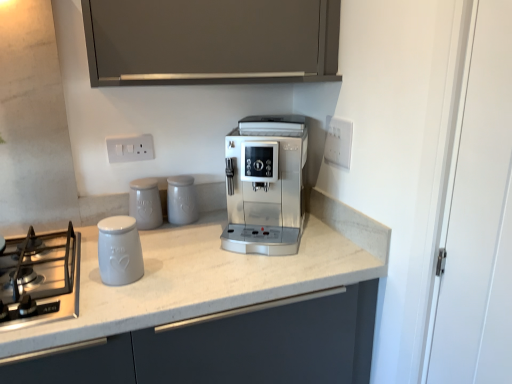
The width and height of the screenshot is (512, 384). Describe the element at coordinates (265, 185) in the screenshot. I see `satin silver coffee maker at center` at that location.

Locate an element on the screen. The height and width of the screenshot is (384, 512). satin silver coffee maker at center is located at coordinates (265, 185).

The height and width of the screenshot is (384, 512). Describe the element at coordinates (40, 279) in the screenshot. I see `stainless steel gas stove at lower left` at that location.

The width and height of the screenshot is (512, 384). Describe the element at coordinates (130, 148) in the screenshot. I see `white plastic electric outlet at upper center, which ranks as the 2th electric outlet in right-to-left order` at that location.

Describe the element at coordinates (338, 142) in the screenshot. This screenshot has width=512, height=384. I see `white plastic electrical outlet at upper right, the first electric outlet from the right` at that location.

How much space does matte ceramic canister at center, placed as the 1th kitchen appliance when sorted from back to front, occupy vertically?

It is 16.87 centimeters.

Locate an element on the screen. satin silver coffee maker at center is located at coordinates (265, 185).

Is satin silver coffee maker at center shorter than matte gray cabinet at upper center?

No, satin silver coffee maker at center is not shorter than matte gray cabinet at upper center.

Is point (249, 128) in front of point (177, 58)?

That is False.

Is satin silver coffee maker at center wider or thinner than matte gray cabinet at upper center?

satin silver coffee maker at center is wider than matte gray cabinet at upper center.

From the image's perspective, is satin silver coffee maker at center located above or below matte gray cabinet at upper center?

satin silver coffee maker at center is below matte gray cabinet at upper center.

Who is taller, matte gray cabinet at upper center or matte ceramic jar at center, the 2th kitchen appliance in the front-to-back sequence?

matte gray cabinet at upper center.

From a real-world perspective, is matte gray cabinet at upper center located higher than matte ceramic jar at center, which is the second kitchen appliance from back to front?

Yes, from a real-world perspective, matte gray cabinet at upper center is over matte ceramic jar at center, which is the second kitchen appliance from back to front

Does matte gray cabinet at upper center have a lesser width compared to matte ceramic jar at center, the 2th kitchen appliance in the front-to-back sequence?

Incorrect, the width of matte gray cabinet at upper center is not less than that of matte ceramic jar at center, the 2th kitchen appliance in the front-to-back sequence.

From the image's perspective, is matte ceramic jar at center, the 2th kitchen appliance in the front-to-back sequence, on white ceramic jar at center, the 1th kitchen appliance from the front?

Yes, from the image's perspective, matte ceramic jar at center, the 2th kitchen appliance in the front-to-back sequence, is on top of white ceramic jar at center, the 1th kitchen appliance from the front.

Can you confirm if matte ceramic jar at center, the 2th kitchen appliance in the front-to-back sequence, is smaller than white ceramic jar at center, the 1th kitchen appliance from the front?

Indeed, matte ceramic jar at center, the 2th kitchen appliance in the front-to-back sequence, has a smaller size compared to white ceramic jar at center, the 1th kitchen appliance from the front.

From a real-world perspective, which is physically above, matte ceramic jar at center, which is the second kitchen appliance from back to front, or white ceramic jar at center, the third kitchen appliance in the back-to-front sequence?

matte ceramic jar at center, which is the second kitchen appliance from back to front, from a real-world perspective.

Could white ceramic jar at center, the 1th kitchen appliance from the front, be considered to be inside matte ceramic jar at center, the 2th kitchen appliance in the front-to-back sequence?

No, white ceramic jar at center, the 1th kitchen appliance from the front, is not surrounded by matte ceramic jar at center, the 2th kitchen appliance in the front-to-back sequence.

Considering the points (329, 129) and (77, 298), which point is behind, point (329, 129) or point (77, 298)?

The point (329, 129) is behind.

Can you confirm if white plastic electrical outlet at upper right, the first electric outlet from the right, is positioned to the left of stainless steel gas stove at lower left?

No.

Does white plastic electrical outlet at upper right, the first electric outlet from the right, have a greater height compared to stainless steel gas stove at lower left?

Indeed, white plastic electrical outlet at upper right, the first electric outlet from the right, has a greater height compared to stainless steel gas stove at lower left.

From a real-world perspective, is white plastic electrical outlet at upper right, positioned as the second electric outlet in left-to-right order, physically located above or below stainless steel gas stove at lower left?

white plastic electrical outlet at upper right, positioned as the second electric outlet in left-to-right order, is situated higher than stainless steel gas stove at lower left in the real world.

From a real-world perspective, is white plastic electrical outlet at upper right, the first electric outlet from the right, physically located above or below white marble countertop at center?

From a real-world perspective, white plastic electrical outlet at upper right, the first electric outlet from the right, is physically above white marble countertop at center.

Could you tell me if white plastic electrical outlet at upper right, the first electric outlet from the right, is facing white marble countertop at center?

No.

Is white plastic electrical outlet at upper right, the first electric outlet from the right, closer to the viewer compared to white marble countertop at center?

No, it is not.

Considering the sizes of objects white plastic electrical outlet at upper right, the first electric outlet from the right, and white marble countertop at center in the image provided, who is shorter, white plastic electrical outlet at upper right, the first electric outlet from the right, or white marble countertop at center?

Standing shorter between the two is white plastic electrical outlet at upper right, the first electric outlet from the right.

Which object is more forward, white plastic electrical outlet at upper right, positioned as the second electric outlet in left-to-right order, or matte ceramic canister at center, placed as the 1th kitchen appliance when sorted from back to front?

white plastic electrical outlet at upper right, positioned as the second electric outlet in left-to-right order.

Which object is positioned more to the right, white plastic electrical outlet at upper right, positioned as the second electric outlet in left-to-right order, or matte ceramic canister at center, placed as the 1th kitchen appliance when sorted from back to front?

Positioned to the right is white plastic electrical outlet at upper right, positioned as the second electric outlet in left-to-right order.

Is white plastic electrical outlet at upper right, the first electric outlet from the right, in contact with matte ceramic canister at center, marked as the third kitchen appliance in a front-to-back arrangement?

No, white plastic electrical outlet at upper right, the first electric outlet from the right, is not touching matte ceramic canister at center, marked as the third kitchen appliance in a front-to-back arrangement.

In terms of width, does white plastic electrical outlet at upper right, positioned as the second electric outlet in left-to-right order, look wider or thinner when compared to matte ceramic canister at center, marked as the third kitchen appliance in a front-to-back arrangement?

Clearly, white plastic electrical outlet at upper right, positioned as the second electric outlet in left-to-right order, has less width compared to matte ceramic canister at center, marked as the third kitchen appliance in a front-to-back arrangement.

Is matte gray cabinet at upper center outside of white plastic electrical outlet at upper right, the first electric outlet from the right?

Yes, matte gray cabinet at upper center is not within white plastic electrical outlet at upper right, the first electric outlet from the right.

How many degrees apart are the facing directions of matte gray cabinet at upper center and white plastic electrical outlet at upper right, positioned as the second electric outlet in left-to-right order?

The facing directions of matte gray cabinet at upper center and white plastic electrical outlet at upper right, positioned as the second electric outlet in left-to-right order, are 90.8 degrees apart.

Is matte gray cabinet at upper center oriented towards white plastic electrical outlet at upper right, positioned as the second electric outlet in left-to-right order?

No, matte gray cabinet at upper center is not facing towards white plastic electrical outlet at upper right, positioned as the second electric outlet in left-to-right order.

This screenshot has height=384, width=512. Find the location of `coffee maker that appears below the matte gray cabinet at upper center (from the image's perspective)`. coffee maker that appears below the matte gray cabinet at upper center (from the image's perspective) is located at coordinates (265, 185).

This screenshot has width=512, height=384. I want to click on cabinetry above the matte ceramic jar at center, which is the second kitchen appliance from back to front (from the image's perspective), so click(x=211, y=41).

Looking at the image, which one is located further to white marble countertop at center, white ceramic jar at center, the third kitchen appliance in the back-to-front sequence, or white plastic electric outlet at upper center, which ranks as the 2th electric outlet in right-to-left order?

Based on the image, white plastic electric outlet at upper center, which ranks as the 2th electric outlet in right-to-left order, appears to be further to white marble countertop at center.

From the image, which object appears to be nearer to satin silver coffee maker at center, white plastic electric outlet at upper center, which ranks as the 2th electric outlet in right-to-left order, or matte gray cabinet at upper center?

Among the two, matte gray cabinet at upper center is located nearer to satin silver coffee maker at center.

Which object lies nearer to the anchor point stainless steel gas stove at lower left, matte gray cabinet at upper center or matte ceramic canister at center, placed as the 1th kitchen appliance when sorted from back to front?

Among the two, matte ceramic canister at center, placed as the 1th kitchen appliance when sorted from back to front, is located nearer to stainless steel gas stove at lower left.

From the image, which object appears to be nearer to matte ceramic jar at center, which is the second kitchen appliance from back to front, white plastic electrical outlet at upper right, the first electric outlet from the right, or stainless steel gas stove at lower left?

stainless steel gas stove at lower left is positioned closer to the anchor matte ceramic jar at center, which is the second kitchen appliance from back to front.

Looking at this image, estimate the real-world distances between objects in this image. Which object is closer to white plastic electric outlet at upper center, positioned as the first electric outlet in left-to-right order, white marble countertop at center or matte gray cabinet at upper center?

Among the two, matte gray cabinet at upper center is located nearer to white plastic electric outlet at upper center, positioned as the first electric outlet in left-to-right order.

From the image, which object appears to be farther from stainless steel gas stove at lower left, white marble countertop at center or matte gray cabinet at upper center?

matte gray cabinet at upper center is positioned further to the anchor stainless steel gas stove at lower left.

Based on their spatial positions, is satin silver coffee maker at center or matte ceramic canister at center, placed as the 1th kitchen appliance when sorted from back to front, closer to stainless steel gas stove at lower left?

The object closer to stainless steel gas stove at lower left is matte ceramic canister at center, placed as the 1th kitchen appliance when sorted from back to front.

When comparing their distances from matte gray cabinet at upper center, does white marble countertop at center or white ceramic jar at center, the third kitchen appliance in the back-to-front sequence, seem further?

The object further to matte gray cabinet at upper center is white marble countertop at center.

Image resolution: width=512 pixels, height=384 pixels. In order to click on coffee maker located between matte ceramic jar at center, the 2th kitchen appliance in the front-to-back sequence, and white plastic electrical outlet at upper right, the first electric outlet from the right, in the left-right direction in this screenshot , I will do `click(265, 185)`.

Locate an element on the screen. Image resolution: width=512 pixels, height=384 pixels. kitchen appliance positioned between white ceramic jar at center, the 1th kitchen appliance from the front, and white plastic electric outlet at upper center, positioned as the first electric outlet in left-to-right order, from near to far is located at coordinates (145, 203).

Where is `home appliance between white marble countertop at center and matte ceramic canister at center, placed as the 1th kitchen appliance when sorted from back to front, in the front-back direction`? Image resolution: width=512 pixels, height=384 pixels. home appliance between white marble countertop at center and matte ceramic canister at center, placed as the 1th kitchen appliance when sorted from back to front, in the front-back direction is located at coordinates (40, 279).

Identify the location of coffee maker located between white ceramic jar at center, the 1th kitchen appliance from the front, and white plastic electrical outlet at upper right, the first electric outlet from the right, in the left-right direction. This screenshot has width=512, height=384. (265, 185).